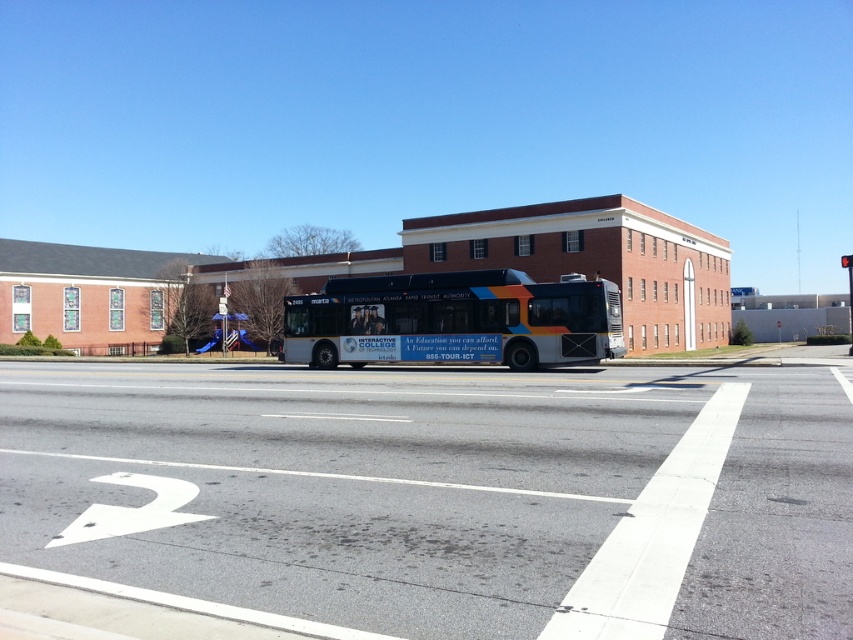
Question: Among these points, which one is nearest to the camera?

Choices:
 (A) (407, 285)
 (B) (341, 540)

Answer: (B)

Question: Does gray asphalt at center have a larger size compared to blue plastic slide at lower center?

Choices:
 (A) no
 (B) yes

Answer: (A)

Question: Among these objects, which one is nearest to the camera?

Choices:
 (A) white matte bus at center
 (B) blue plastic slide at lower center
 (C) gray asphalt at center

Answer: (C)

Question: Which point is closer to the camera?

Choices:
 (A) (683, 378)
 (B) (572, 321)

Answer: (A)

Question: Is white matte bus at center thinner than blue plastic slide at lower center?

Choices:
 (A) no
 (B) yes

Answer: (A)

Question: Does gray asphalt at center appear under white matte bus at center?

Choices:
 (A) yes
 (B) no

Answer: (A)